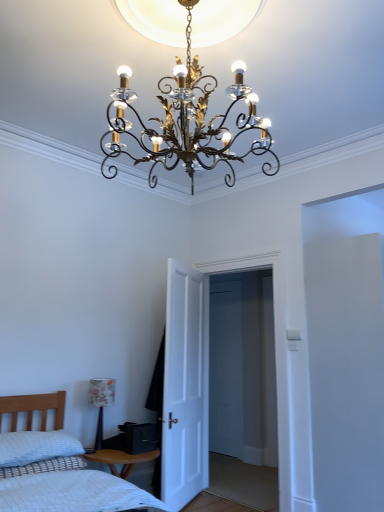
Question: From a real-world perspective, does white textured pillow at lower left stand above gold metallic chandelier at center, positioned as the first lamp in top-to-bottom order?

Choices:
 (A) no
 (B) yes

Answer: (A)

Question: Is white textured pillow at lower left not close to gold metallic chandelier at center, marked as the second lamp in a left-to-right arrangement?

Choices:
 (A) yes
 (B) no

Answer: (A)

Question: Is white textured pillow at lower left positioned with its back to gold metallic chandelier at center, which appears as the first lamp when viewed from the front?

Choices:
 (A) no
 (B) yes

Answer: (A)

Question: From the image's perspective, does white textured pillow at lower left appear higher than gold metallic chandelier at center, the 1th lamp positioned from the right?

Choices:
 (A) yes
 (B) no

Answer: (B)

Question: Does white textured pillow at lower left have a lesser width compared to gold metallic chandelier at center, which appears as the first lamp when viewed from the front?

Choices:
 (A) no
 (B) yes

Answer: (B)

Question: Visually, is white textured pillow at lower left positioned to the left or to the right of white matte door at center?

Choices:
 (A) right
 (B) left

Answer: (B)

Question: Considering the positions of white textured pillow at lower left and white matte door at center in the image, is white textured pillow at lower left bigger or smaller than white matte door at center?

Choices:
 (A) small
 (B) big

Answer: (A)

Question: From their relative heights in the image, would you say white textured pillow at lower left is taller or shorter than white matte door at center?

Choices:
 (A) short
 (B) tall

Answer: (A)

Question: From a real-world perspective, relative to white matte door at center, is white textured pillow at lower left vertically above or below?

Choices:
 (A) below
 (B) above

Answer: (A)

Question: From the image's perspective, is white textured pillow at lower left above or below gold metallic chandelier at center, which is counted as the 2th lamp, starting from the back?

Choices:
 (A) below
 (B) above

Answer: (A)

Question: In terms of height, does white textured pillow at lower left look taller or shorter compared to gold metallic chandelier at center, marked as the second lamp in a bottom-to-top arrangement?

Choices:
 (A) tall
 (B) short

Answer: (B)

Question: Looking at their shapes, would you say white textured pillow at lower left is wider or thinner than gold metallic chandelier at center, which is counted as the 2th lamp, starting from the back?

Choices:
 (A) wide
 (B) thin

Answer: (B)

Question: Is white textured pillow at lower left in front of or behind gold metallic chandelier at center, the 1th lamp positioned from the right, in the image?

Choices:
 (A) behind
 (B) front

Answer: (A)

Question: Would you say gold metallic chandelier at center, the 1th lamp positioned from the right, is inside or outside white matte door at center?

Choices:
 (A) outside
 (B) inside

Answer: (A)

Question: Based on their sizes in the image, would you say gold metallic chandelier at center, marked as the second lamp in a bottom-to-top arrangement, is bigger or smaller than white matte door at center?

Choices:
 (A) big
 (B) small

Answer: (A)